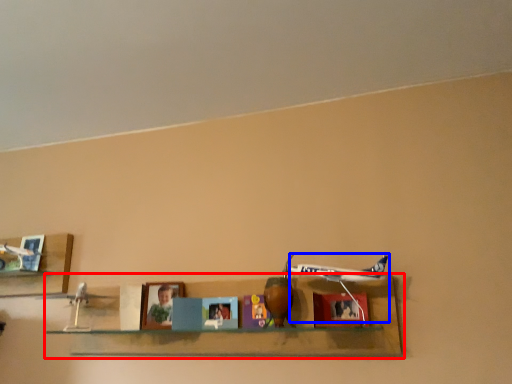
Question: Which object is closer to the camera taking this photo, shelf (highlighted by a red box) or plane (highlighted by a blue box)?

Choices:
 (A) shelf
 (B) plane

Answer: (A)